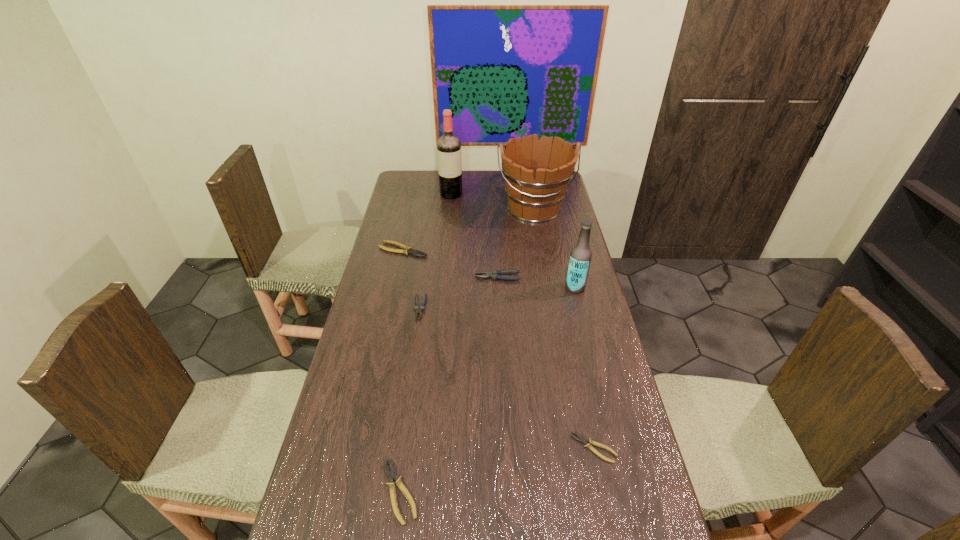
Identify the location of blank area in the image that satisfies the following two spatial constraints: 1. on the side of the beer bottle with the label; 2. at the gripping part of the third nearest pliers. This screenshot has width=960, height=540. (580, 308).

This screenshot has height=540, width=960. Find the location of `vacant area in the image that satisfies the following two spatial constraints: 1. at the gripping part of the third nearest pliers; 2. on the right side of the smallest yellow pliers`. vacant area in the image that satisfies the following two spatial constraints: 1. at the gripping part of the third nearest pliers; 2. on the right side of the smallest yellow pliers is located at coordinates (399, 448).

The image size is (960, 540). I want to click on free spot that satisfies the following two spatial constraints: 1. with the handle on the rightmost yellow pliers; 2. on the left side of the wine bucket, so click(573, 448).